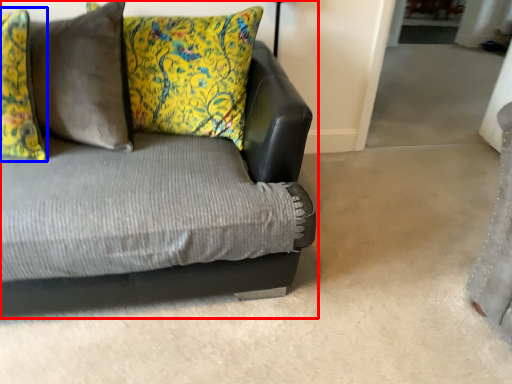
Question: Which of the following is the farthest to the observer, studio couch (highlighted by a red box) or pillow (highlighted by a blue box)?

Choices:
 (A) studio couch
 (B) pillow

Answer: (B)